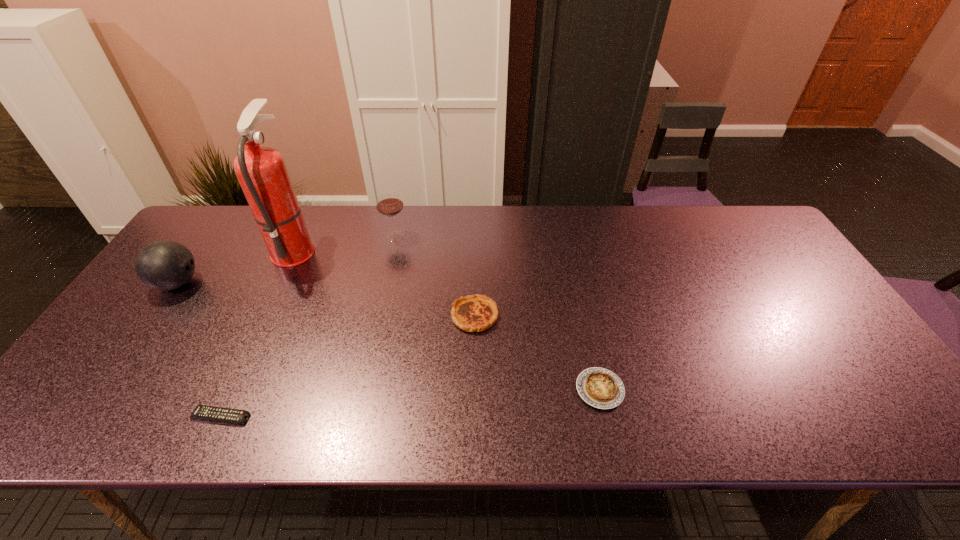
This screenshot has width=960, height=540. In order to click on fire extinguisher in this screenshot , I will do `click(262, 173)`.

Where is `wineglass`? The width and height of the screenshot is (960, 540). wineglass is located at coordinates (389, 203).

Identify the location of the leftmost object. (163, 265).

Identify the location of the fifth object from left to right. (475, 313).

Locate an element on the screen. the taller quiche is located at coordinates (475, 313).

I want to click on the rightmost object, so click(x=601, y=388).

Where is `the second shortest object`? This screenshot has width=960, height=540. the second shortest object is located at coordinates (601, 388).

Locate an element on the screen. The image size is (960, 540). the shortest object is located at coordinates (214, 413).

Locate an element on the screen. The image size is (960, 540). free space located with the handle and hose on the fire extinguisher is located at coordinates (436, 249).

At what (x,y) coordinates should I click in order to perform the action: click on vacant space located on the right of the wineglass. Please return your answer as a coordinate pair (x, y). The width and height of the screenshot is (960, 540). Looking at the image, I should click on (433, 235).